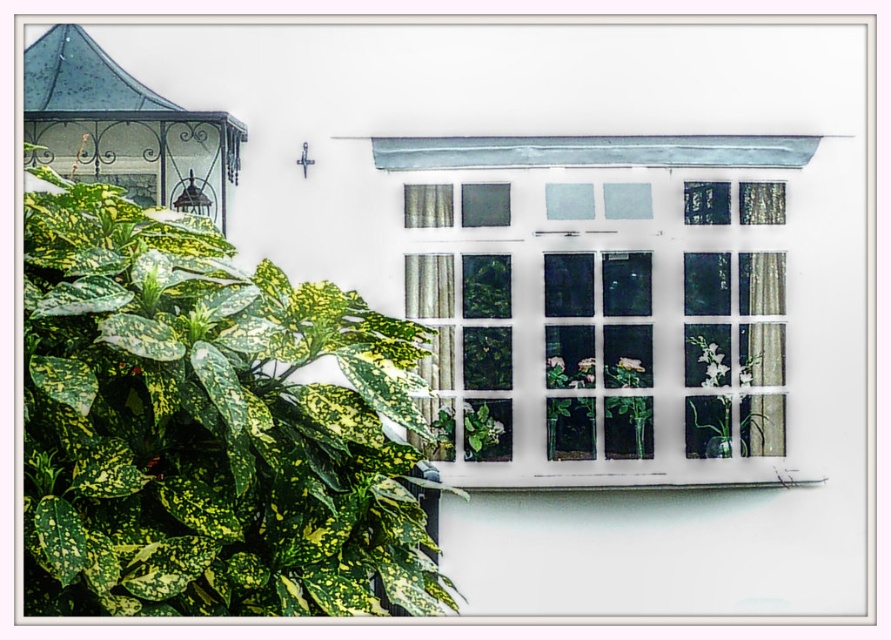
Is translucent glass vase at center-right below white painted wood at lower center?

No, translucent glass vase at center-right is not below white painted wood at lower center.

Can you confirm if translucent glass vase at center-right is positioned to the right of white painted wood at lower center?

Correct, you'll find translucent glass vase at center-right to the right of white painted wood at lower center.

This screenshot has width=891, height=640. What are the coordinates of `translucent glass vase at center-right` in the screenshot? It's located at (734, 388).

You are a GUI agent. You are given a task and a screenshot of the screen. Output one action in this format:
    pyautogui.click(x=<x>, y=<y>)
    Task: Click on the translucent glass vase at center-right
    The height and width of the screenshot is (640, 891).
    Given the screenshot: What is the action you would take?
    point(734,388)

Measure the distance between point (78, 202) and camera.

Point (78, 202) is 3.02 meters from camera.

Does green variegated leaf at left have a smaller size compared to translucent glass vase at center-right?

No.

Between point (340, 490) and point (716, 364), which one is positioned behind?

Positioned behind is point (716, 364).

Locate an element on the screen. The height and width of the screenshot is (640, 891). green variegated leaf at left is located at coordinates (207, 426).

Is white painted wood at lower center wider than green glossy plant at center?

Yes.

Is white painted wood at lower center positioned in front of green glossy plant at center?

Yes, white painted wood at lower center is in front of green glossy plant at center.

Which is behind, point (601, 484) or point (651, 417)?

The point (651, 417) is more distant.

I want to click on white painted wood at lower center, so click(x=611, y=481).